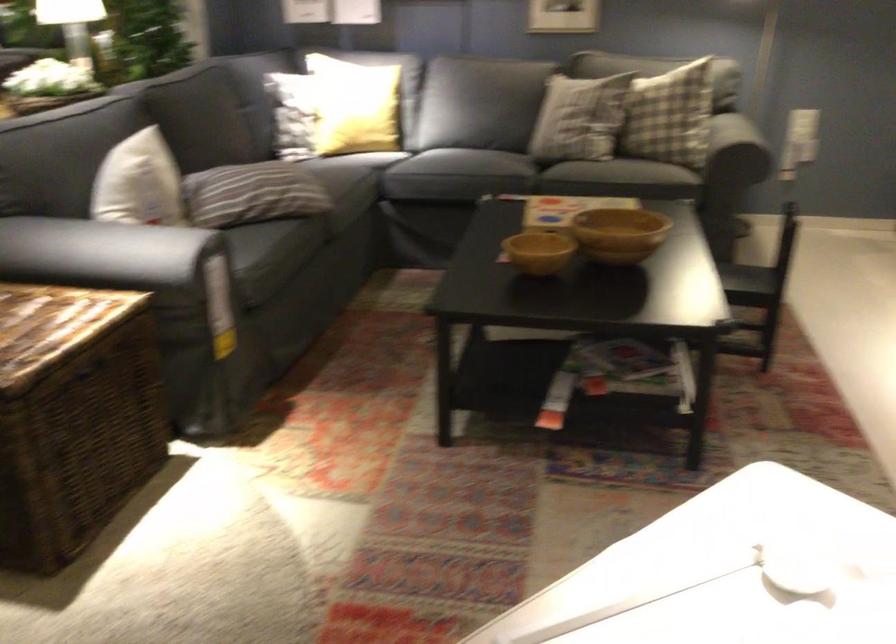
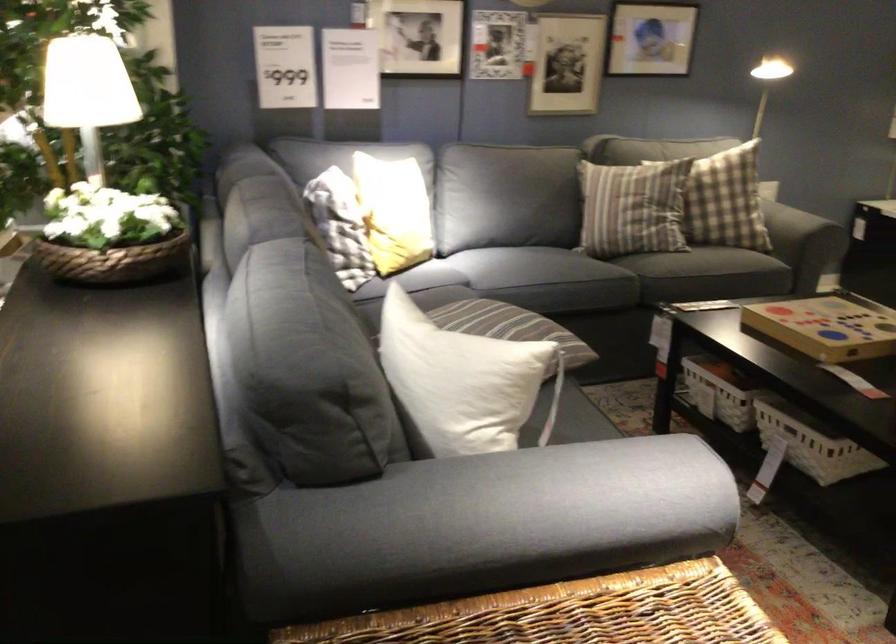
Find the pixel in the second image that matches (x=528, y=212) in the first image.

(828, 326)